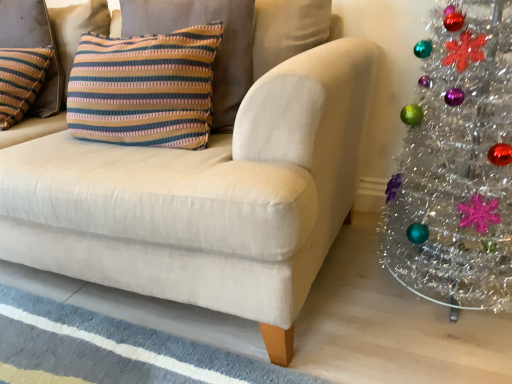
What do you see at coordinates (207, 189) in the screenshot? This screenshot has width=512, height=384. I see `matte beige couch at center` at bounding box center [207, 189].

I want to click on knitted striped pillow at upper left, positioned as the second pillow in right-to-left order, so click(33, 47).

Does striped fabric pillow at upper left, which is the first pillow in right-to-left order, touch shiny silver christmas tree at right?

No, striped fabric pillow at upper left, which is the first pillow in right-to-left order, is not with shiny silver christmas tree at right.

Is striped fabric pillow at upper left, which is the first pillow in right-to-left order, thinner than shiny silver christmas tree at right?

Yes.

From a real-world perspective, relative to shiny silver christmas tree at right, is striped fabric pillow at upper left, which is the 2th pillow in left-to-right order, vertically above or below?

striped fabric pillow at upper left, which is the 2th pillow in left-to-right order, is situated higher than shiny silver christmas tree at right in the real world.

Is striped fabric pillow at upper left, which is the first pillow in right-to-left order, to the left of shiny silver christmas tree at right from the viewer's perspective?

Yes.

Is matte beige couch at center placed right next to shiny silver christmas tree at right?

No, matte beige couch at center is not with shiny silver christmas tree at right.

Do you think matte beige couch at center is within shiny silver christmas tree at right, or outside of it?

matte beige couch at center is located beyond the bounds of shiny silver christmas tree at right.

Between matte beige couch at center and shiny silver christmas tree at right, which one is positioned in front?

matte beige couch at center is more forward.

Does point (45, 208) appear closer or farther from the camera than point (509, 118)?

Point (45, 208) is positioned closer to the camera compared to point (509, 118).

From the image's perspective, would you say matte beige couch at center is shown under knitted striped pillow at upper left, positioned as the second pillow in right-to-left order?

Yes.

In terms of width, does matte beige couch at center look wider or thinner when compared to knitted striped pillow at upper left, positioned as the second pillow in right-to-left order?

matte beige couch at center is wider than knitted striped pillow at upper left, positioned as the second pillow in right-to-left order.

Between point (362, 44) and point (48, 106), which one is positioned in front?

The point (362, 44) is more forward.

Does knitted striped pillow at upper left, positioned as the second pillow in right-to-left order, have a larger size compared to striped fabric pillow at upper left, which is the 2th pillow in left-to-right order?

Actually, knitted striped pillow at upper left, positioned as the second pillow in right-to-left order, might be smaller than striped fabric pillow at upper left, which is the 2th pillow in left-to-right order.

Does knitted striped pillow at upper left, which ranks as the first pillow in left-to-right order, appear on the right side of striped fabric pillow at upper left, which is the first pillow in right-to-left order?

No, knitted striped pillow at upper left, which ranks as the first pillow in left-to-right order, is not to the right of striped fabric pillow at upper left, which is the first pillow in right-to-left order.

Would you say striped fabric pillow at upper left, which is the 2th pillow in left-to-right order, is part of knitted striped pillow at upper left, which ranks as the first pillow in left-to-right order,'s contents?

No, knitted striped pillow at upper left, which ranks as the first pillow in left-to-right order, does not contain striped fabric pillow at upper left, which is the 2th pillow in left-to-right order.

Is knitted striped pillow at upper left, positioned as the second pillow in right-to-left order, further to camera compared to striped fabric pillow at upper left, which is the first pillow in right-to-left order?

That is True.

Considering the positions of objects striped fabric pillow at upper left, which is the 2th pillow in left-to-right order, and knitted striped pillow at upper left, which ranks as the first pillow in left-to-right order, in the image provided, who is more to the right, striped fabric pillow at upper left, which is the 2th pillow in left-to-right order, or knitted striped pillow at upper left, which ranks as the first pillow in left-to-right order,?

From the viewer's perspective, striped fabric pillow at upper left, which is the 2th pillow in left-to-right order, appears more on the right side.

From the image's perspective, is striped fabric pillow at upper left, which is the first pillow in right-to-left order, below knitted striped pillow at upper left, positioned as the second pillow in right-to-left order?

Correct, striped fabric pillow at upper left, which is the first pillow in right-to-left order, appears lower than knitted striped pillow at upper left, positioned as the second pillow in right-to-left order, in the image.

Measure the distance from striped fabric pillow at upper left, which is the 2th pillow in left-to-right order, to knitted striped pillow at upper left, positioned as the second pillow in right-to-left order.

striped fabric pillow at upper left, which is the 2th pillow in left-to-right order, and knitted striped pillow at upper left, positioned as the second pillow in right-to-left order, are 21.28 inches apart.

In order to click on pillow that is on the left side of striped fabric pillow at upper left, which is the 2th pillow in left-to-right order in this screenshot , I will do `click(33, 47)`.

In the scene shown: From a real-world perspective, between matte beige couch at center and striped fabric pillow at upper left, which is the first pillow in right-to-left order, who is vertically lower?

From a 3D spatial view, matte beige couch at center is below.

From the image's perspective, is matte beige couch at center on top of striped fabric pillow at upper left, which is the first pillow in right-to-left order?

No, from the image's perspective, matte beige couch at center is not above striped fabric pillow at upper left, which is the first pillow in right-to-left order.

Does matte beige couch at center turn towards striped fabric pillow at upper left, which is the 2th pillow in left-to-right order?

Yes, matte beige couch at center is facing striped fabric pillow at upper left, which is the 2th pillow in left-to-right order.

Which of these two, matte beige couch at center or striped fabric pillow at upper left, which is the first pillow in right-to-left order, is smaller?

striped fabric pillow at upper left, which is the first pillow in right-to-left order, is smaller.

Is knitted striped pillow at upper left, positioned as the second pillow in right-to-left order, facing towards matte beige couch at center?

Yes, knitted striped pillow at upper left, positioned as the second pillow in right-to-left order, is oriented towards matte beige couch at center.

Does knitted striped pillow at upper left, positioned as the second pillow in right-to-left order, have a smaller size compared to matte beige couch at center?

Indeed, knitted striped pillow at upper left, positioned as the second pillow in right-to-left order, has a smaller size compared to matte beige couch at center.

Which object is further away from the camera, knitted striped pillow at upper left, which ranks as the first pillow in left-to-right order, or matte beige couch at center?

knitted striped pillow at upper left, which ranks as the first pillow in left-to-right order, is further from the camera.

How different are the orientations of knitted striped pillow at upper left, which ranks as the first pillow in left-to-right order, and matte beige couch at center in degrees?

The angular difference between knitted striped pillow at upper left, which ranks as the first pillow in left-to-right order, and matte beige couch at center is 0.000554 degrees.

Identify the location of the 1st pillow behind the shiny silver christmas tree at right. (144, 88).

This screenshot has width=512, height=384. Identify the location of studio couch that appears above the shiny silver christmas tree at right (from the image's perspective). (207, 189).

Based on their spatial positions, is shiny silver christmas tree at right or matte beige couch at center further from striped fabric pillow at upper left, which is the first pillow in right-to-left order?

The object further to striped fabric pillow at upper left, which is the first pillow in right-to-left order, is shiny silver christmas tree at right.

Which object lies nearer to the anchor point matte beige couch at center, knitted striped pillow at upper left, positioned as the second pillow in right-to-left order, or shiny silver christmas tree at right?

Among the two, shiny silver christmas tree at right is located nearer to matte beige couch at center.

From the image, which object appears to be nearer to knitted striped pillow at upper left, positioned as the second pillow in right-to-left order, shiny silver christmas tree at right or striped fabric pillow at upper left, which is the first pillow in right-to-left order?

striped fabric pillow at upper left, which is the first pillow in right-to-left order, is positioned closer to the anchor knitted striped pillow at upper left, positioned as the second pillow in right-to-left order.

Based on their spatial positions, is knitted striped pillow at upper left, which ranks as the first pillow in left-to-right order, or striped fabric pillow at upper left, which is the 2th pillow in left-to-right order, closer to matte beige couch at center?

striped fabric pillow at upper left, which is the 2th pillow in left-to-right order, is positioned closer to the anchor matte beige couch at center.

Looking at the image, which one is located closer to shiny silver christmas tree at right, striped fabric pillow at upper left, which is the 2th pillow in left-to-right order, or knitted striped pillow at upper left, which ranks as the first pillow in left-to-right order?

striped fabric pillow at upper left, which is the 2th pillow in left-to-right order, is closer to shiny silver christmas tree at right.

Estimate the real-world distances between objects in this image. Which object is further from matte beige couch at center, striped fabric pillow at upper left, which is the first pillow in right-to-left order, or knitted striped pillow at upper left, which ranks as the first pillow in left-to-right order?

The object further to matte beige couch at center is knitted striped pillow at upper left, which ranks as the first pillow in left-to-right order.

From the image, which object appears to be nearer to striped fabric pillow at upper left, which is the first pillow in right-to-left order, matte beige couch at center or knitted striped pillow at upper left, which ranks as the first pillow in left-to-right order?

matte beige couch at center is positioned closer to the anchor striped fabric pillow at upper left, which is the first pillow in right-to-left order.

When comparing their distances from matte beige couch at center, does shiny silver christmas tree at right or striped fabric pillow at upper left, which is the first pillow in right-to-left order, seem closer?

Among the two, striped fabric pillow at upper left, which is the first pillow in right-to-left order, is located nearer to matte beige couch at center.

This screenshot has height=384, width=512. I want to click on pillow positioned between matte beige couch at center and knitted striped pillow at upper left, which ranks as the first pillow in left-to-right order, from near to far, so click(144, 88).

Locate an element on the screen. The width and height of the screenshot is (512, 384). studio couch situated between knitted striped pillow at upper left, which ranks as the first pillow in left-to-right order, and shiny silver christmas tree at right from left to right is located at coordinates (207, 189).

The height and width of the screenshot is (384, 512). Identify the location of pillow located between knitted striped pillow at upper left, which ranks as the first pillow in left-to-right order, and shiny silver christmas tree at right in the left-right direction. click(x=144, y=88).

Find the location of a particular element. pillow situated between matte beige couch at center and shiny silver christmas tree at right from left to right is located at coordinates (144, 88).